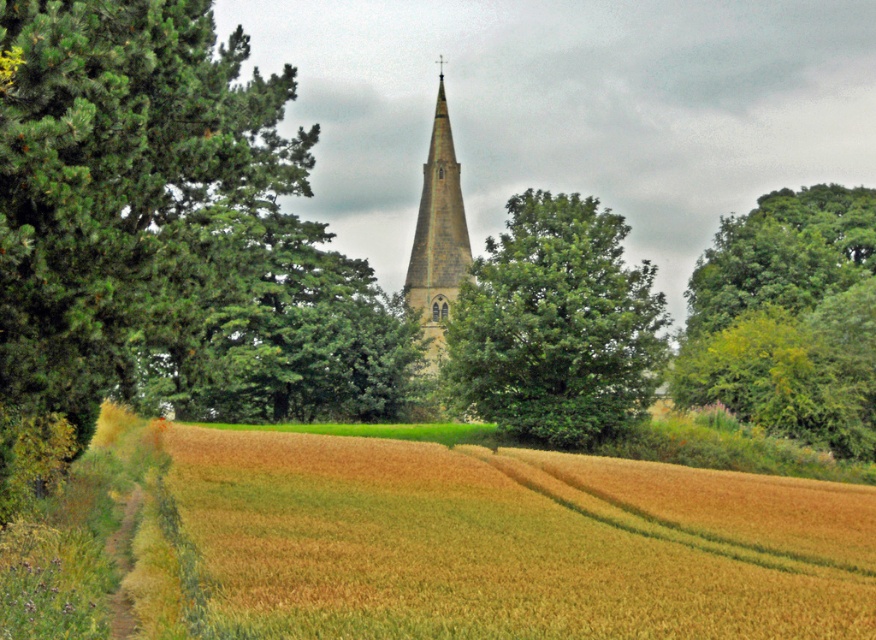
Question: Does golden wheat field at lower left appear over green leafy tree at upper right?

Choices:
 (A) yes
 (B) no

Answer: (B)

Question: In this image, where is green leafy tree at center located relative to light brown stone steeple at center?

Choices:
 (A) left
 (B) right

Answer: (B)

Question: Which of the following is the farthest from the observer?

Choices:
 (A) green leafy tree at center
 (B) golden wheat field at lower left
 (C) green leafy tree at upper right

Answer: (C)

Question: Does green leafy tree at upper right appear on the left side of green leafy tree at center?

Choices:
 (A) yes
 (B) no

Answer: (B)

Question: Based on their relative distances, which object is farther from the golden wheat field at lower left?

Choices:
 (A) light brown stone steeple at center
 (B) green leafy tree at center
 (C) green leafy tree at upper right

Answer: (A)

Question: Which point is closer to the camera?

Choices:
 (A) (507, 413)
 (B) (510, 540)
 (C) (412, 392)
 (D) (806, 403)

Answer: (B)